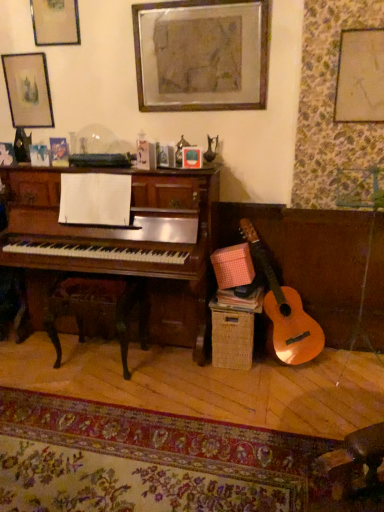
Question: Is matte glass picture frame at upper center, which appears as the 3th picture frame when viewed from the left, not inside matte gold picture frame at upper left, the 4th picture frame when ordered from right to left?

Choices:
 (A) yes
 (B) no

Answer: (A)

Question: From the image's perspective, is matte glass picture frame at upper center, arranged as the third picture frame when viewed from the right, located beneath matte gold picture frame at upper left, the 4th picture frame when ordered from right to left?

Choices:
 (A) no
 (B) yes

Answer: (B)

Question: Considering the relative sizes of matte glass picture frame at upper center, arranged as the third picture frame when viewed from the right, and matte gold picture frame at upper left, the 4th picture frame when ordered from right to left, in the image provided, is matte glass picture frame at upper center, arranged as the third picture frame when viewed from the right, wider than matte gold picture frame at upper left, the 4th picture frame when ordered from right to left,?

Choices:
 (A) no
 (B) yes

Answer: (B)

Question: Can you confirm if matte glass picture frame at upper center, which appears as the 3th picture frame when viewed from the left, is bigger than matte gold picture frame at upper left, positioned as the 2th picture frame in left-to-right order?

Choices:
 (A) yes
 (B) no

Answer: (B)

Question: Does matte glass picture frame at upper center, arranged as the third picture frame when viewed from the right, have a smaller size compared to matte gold picture frame at upper left, positioned as the 2th picture frame in left-to-right order?

Choices:
 (A) yes
 (B) no

Answer: (A)

Question: In the image, is matte gold picture frame at upper right, the fifth picture frame when ordered from left to right, positioned in front of or behind wooden rocking chair at lower left?

Choices:
 (A) behind
 (B) front

Answer: (B)

Question: In terms of size, does matte gold picture frame at upper right, the fifth picture frame when ordered from left to right, appear bigger or smaller than wooden rocking chair at lower left?

Choices:
 (A) big
 (B) small

Answer: (B)

Question: Looking at their shapes, would you say matte gold picture frame at upper right, the fifth picture frame when ordered from left to right, is wider or thinner than wooden rocking chair at lower left?

Choices:
 (A) wide
 (B) thin

Answer: (B)

Question: From a real-world perspective, is matte gold picture frame at upper right, which is counted as the first picture frame, starting from the right, positioned above or below wooden rocking chair at lower left?

Choices:
 (A) above
 (B) below

Answer: (A)

Question: From the image's perspective, is matte black picture frame at upper left, positioned as the 1th picture frame in left-to-right order, positioned above or below matte gold picture frame at upper left, positioned as the 2th picture frame in left-to-right order?

Choices:
 (A) above
 (B) below

Answer: (B)

Question: In the image, is matte black picture frame at upper left, which appears as the 5th picture frame when viewed from the right, on the left side or the right side of matte gold picture frame at upper left, positioned as the 2th picture frame in left-to-right order?

Choices:
 (A) left
 (B) right

Answer: (A)

Question: Considering the positions of matte black picture frame at upper left, positioned as the 1th picture frame in left-to-right order, and matte gold picture frame at upper left, positioned as the 2th picture frame in left-to-right order, in the image, is matte black picture frame at upper left, positioned as the 1th picture frame in left-to-right order, bigger or smaller than matte gold picture frame at upper left, positioned as the 2th picture frame in left-to-right order,?

Choices:
 (A) small
 (B) big

Answer: (B)

Question: Is matte black picture frame at upper left, which appears as the 5th picture frame when viewed from the right, inside the boundaries of matte gold picture frame at upper left, the 4th picture frame when ordered from right to left, or outside?

Choices:
 (A) inside
 (B) outside

Answer: (B)

Question: Based on their positions, is matte black picture frame at upper left, which appears as the 5th picture frame when viewed from the right, located to the left or right of matte glass picture frame at upper center, arranged as the third picture frame when viewed from the right?

Choices:
 (A) left
 (B) right

Answer: (A)

Question: From a real-world perspective, is matte black picture frame at upper left, positioned as the 1th picture frame in left-to-right order, physically located above or below matte glass picture frame at upper center, arranged as the third picture frame when viewed from the right?

Choices:
 (A) above
 (B) below

Answer: (A)